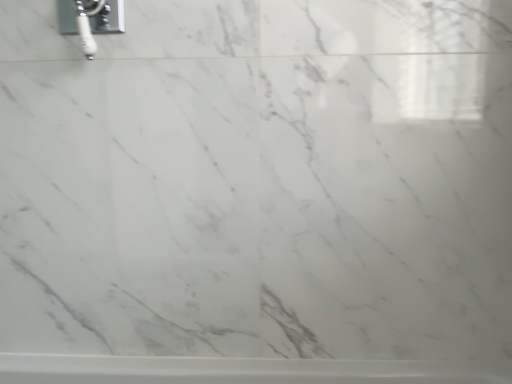
Question: Is chrome metallic faucet at upper left inside the boundaries of white glossy bathtub at lower center, or outside?

Choices:
 (A) outside
 (B) inside

Answer: (A)

Question: Considering the positions of chrome metallic faucet at upper left and white glossy bathtub at lower center in the image, is chrome metallic faucet at upper left wider or thinner than white glossy bathtub at lower center?

Choices:
 (A) thin
 (B) wide

Answer: (A)

Question: Is chrome metallic faucet at upper left in front of or behind white glossy bathtub at lower center in the image?

Choices:
 (A) front
 (B) behind

Answer: (A)

Question: Considering the relative positions of white glossy bathtub at lower center and chrome metallic faucet at upper left in the image provided, is white glossy bathtub at lower center to the left or to the right of chrome metallic faucet at upper left?

Choices:
 (A) right
 (B) left

Answer: (A)

Question: In terms of width, does white glossy bathtub at lower center look wider or thinner when compared to chrome metallic faucet at upper left?

Choices:
 (A) wide
 (B) thin

Answer: (A)

Question: Is white glossy bathtub at lower center spatially inside chrome metallic faucet at upper left, or outside of it?

Choices:
 (A) inside
 (B) outside

Answer: (B)

Question: From their relative heights in the image, would you say white glossy bathtub at lower center is taller or shorter than chrome metallic faucet at upper left?

Choices:
 (A) tall
 (B) short

Answer: (B)